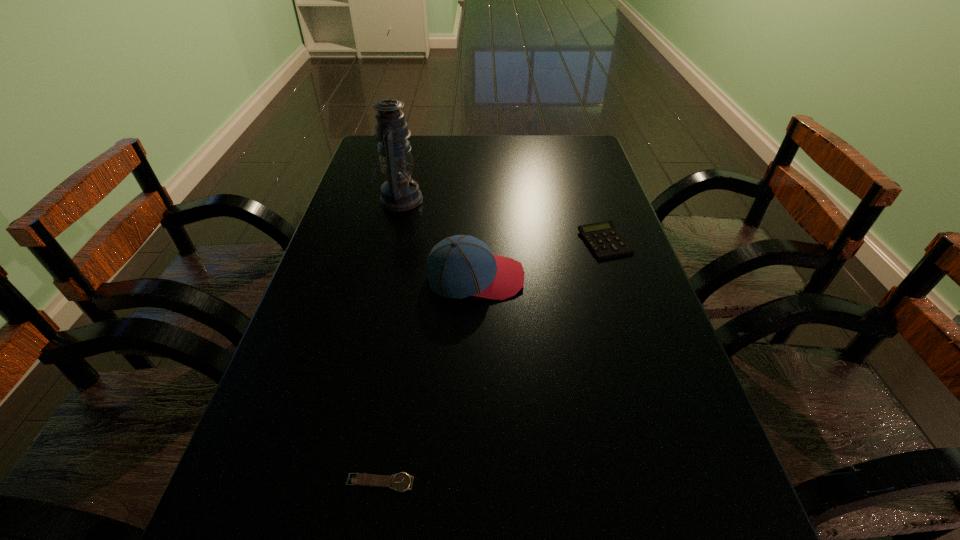
Find the location of a particular element. free space between the tallest object and the nearest object is located at coordinates (390, 341).

Locate an element on the screen. This screenshot has width=960, height=540. vacant area that lies between the nearest object and the second tallest object is located at coordinates (428, 380).

Locate an element on the screen. free space between the third tallest object and the third shortest object is located at coordinates (540, 260).

Locate an element on the screen. unoccupied position between the baseball cap and the watch is located at coordinates (428, 380).

Find the location of `free space between the second shortest object and the tallest object`. free space between the second shortest object and the tallest object is located at coordinates (502, 221).

In order to click on vacant area that lies between the farthest object and the watch in this screenshot , I will do `click(390, 341)`.

Image resolution: width=960 pixels, height=540 pixels. I want to click on free area in between the watch and the farthest object, so click(390, 341).

This screenshot has width=960, height=540. What are the coordinates of `vacant space that's between the shortest object and the lantern` in the screenshot? It's located at (390, 341).

Locate an element on the screen. Image resolution: width=960 pixels, height=540 pixels. object that is the third closest to the watch is located at coordinates (399, 192).

Where is `the second closest object to the calculator`? Image resolution: width=960 pixels, height=540 pixels. the second closest object to the calculator is located at coordinates [x=399, y=192].